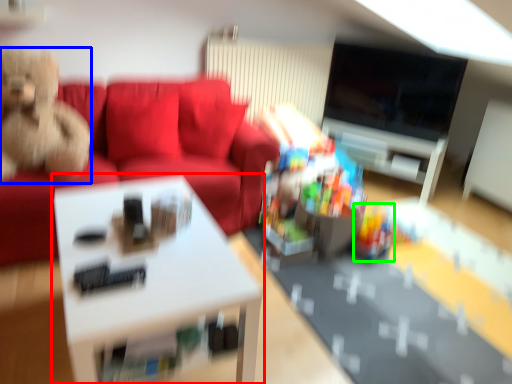
Question: Which is farther away from table (highlighted by a red box)? toy (highlighted by a blue box) or toy (highlighted by a green box)?

Choices:
 (A) toy
 (B) toy

Answer: (B)